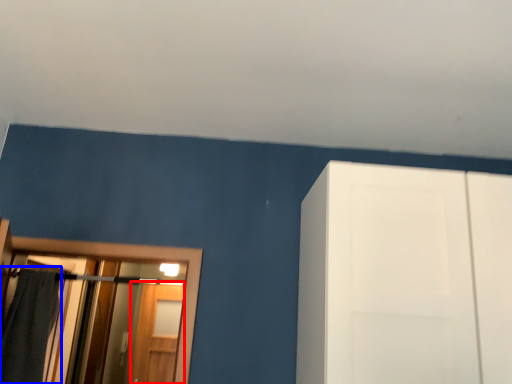
Question: Which object appears closest to the camera in this image, screen door (highlighted by a red box) or bath towel (highlighted by a blue box)?

Choices:
 (A) screen door
 (B) bath towel

Answer: (B)